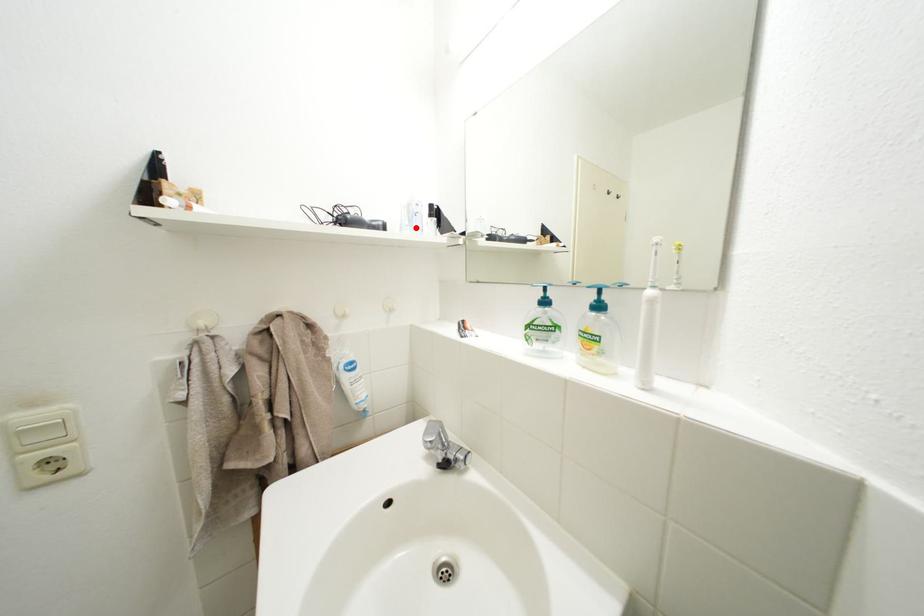
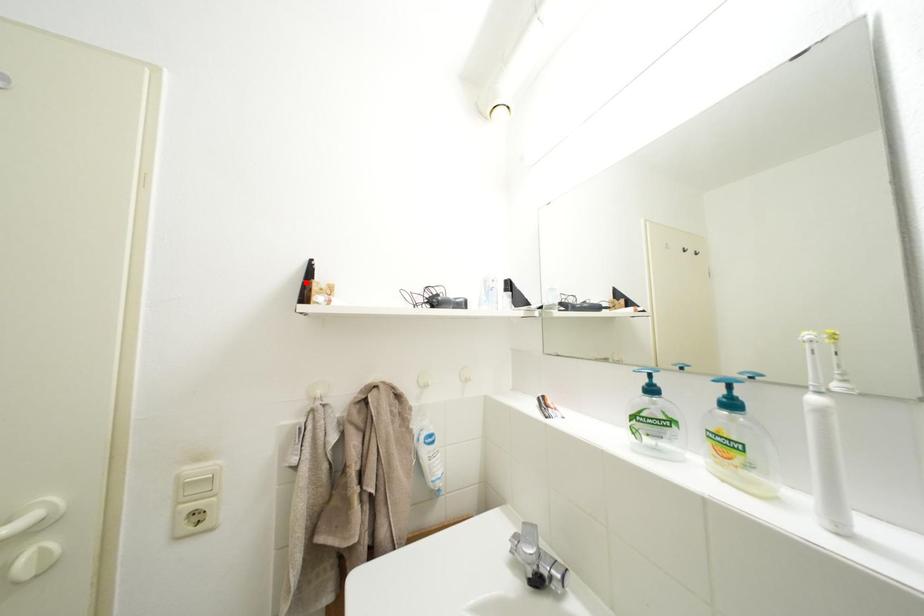
I am providing you with two images of the same scene from different viewpoints. A red point is marked on the first image and another point is marked on the second image. Is the red point in image1 aligned with the point shown in image2?

No